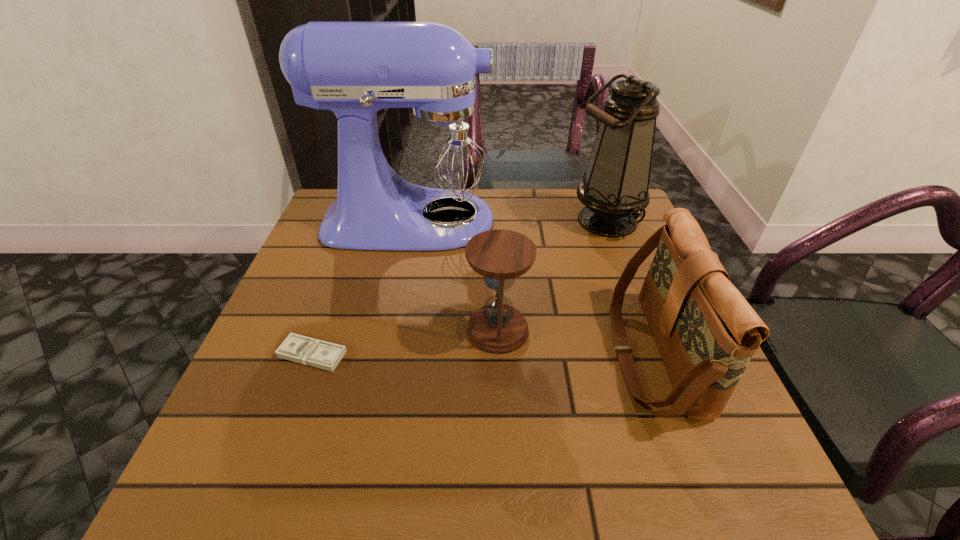
Find the location of a particular element. free space located on the back of the second shortest object is located at coordinates (493, 224).

Identify the location of blank space located on the back of the money. (325, 319).

Where is `mixer that is positioned at the far edge`? This screenshot has width=960, height=540. mixer that is positioned at the far edge is located at coordinates (427, 187).

Where is `oil lamp at the far edge`? oil lamp at the far edge is located at coordinates (614, 188).

This screenshot has height=540, width=960. What are the coordinates of `mixer situated at the left edge` in the screenshot? It's located at (427, 187).

The image size is (960, 540). What are the coordinates of `money that is at the left edge` in the screenshot? It's located at (305, 350).

This screenshot has height=540, width=960. Identify the location of oil lamp located in the right edge section of the desktop. (614, 188).

Where is `shoulder bag that is at the right edge`? shoulder bag that is at the right edge is located at coordinates (706, 331).

Locate an element on the screen. This screenshot has height=540, width=960. object situated at the far left corner is located at coordinates (427, 187).

Identify the location of object positioned at the far right corner. (614, 188).